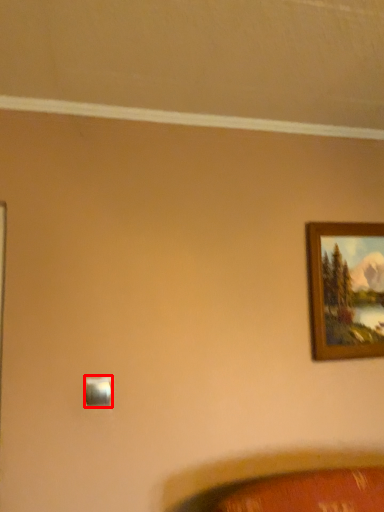
Question: From the image's perspective, what is the correct spatial positioning of light switch (annotated by the red box) in reference to picture frame?

Choices:
 (A) below
 (B) above

Answer: (A)